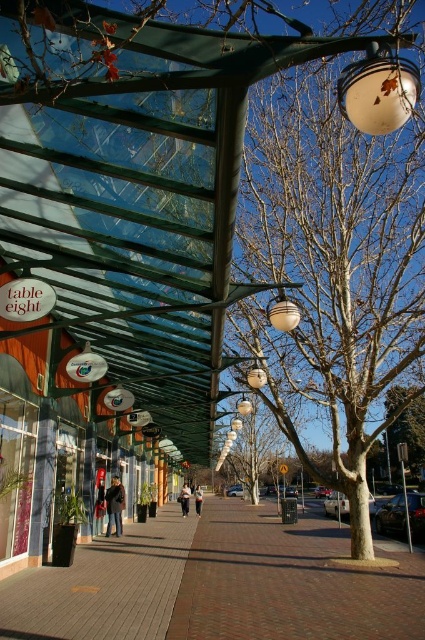
Can you confirm if brick pavement at center is smaller than dark blue jeans at center?

Incorrect, brick pavement at center is not smaller in size than dark blue jeans at center.

Based on the photo, is brick pavement at center to the left of dark blue jeans at center from the viewer's perspective?

Incorrect, brick pavement at center is not on the left side of dark blue jeans at center.

Who is more forward, (280,566) or (187,515)?

Point (280,566) is in front.

Locate an element on the screen. brick pavement at center is located at coordinates (291, 580).

Can you confirm if green leafy tree at center is positioned above metallic pole at center?

Correct, green leafy tree at center is located above metallic pole at center.

Does green leafy tree at center have a greater height compared to metallic pole at center?

Correct, green leafy tree at center is much taller as metallic pole at center.

Where is `green leafy tree at center`? The image size is (425, 640). green leafy tree at center is located at coordinates (408, 436).

Identify the location of green leafy tree at center. The width and height of the screenshot is (425, 640). (408, 436).

Does bare branches at center have a lesser height compared to dark blue jacket at center?

No.

Does point (266, 445) come closer to viewer compared to point (121, 515)?

That is False.

The width and height of the screenshot is (425, 640). I want to click on bare branches at center, so click(251, 449).